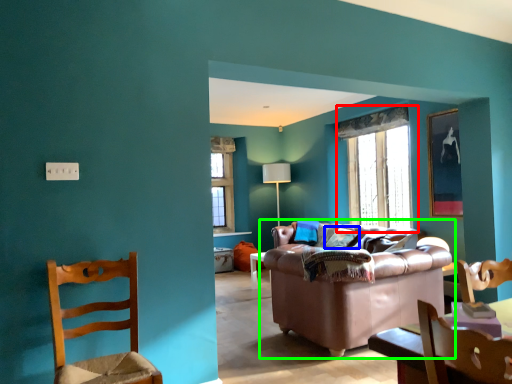
Question: Which is farther away from window (highlighted by a red box)? pillow (highlighted by a blue box) or studio couch (highlighted by a green box)?

Choices:
 (A) pillow
 (B) studio couch

Answer: (B)